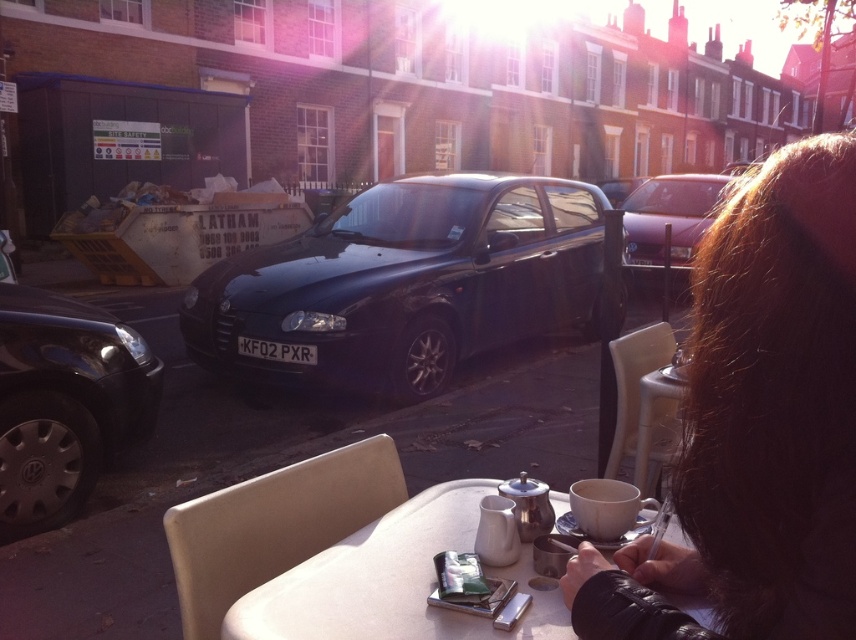
Who is higher up, dark brown hair at upper right or metallic purple car at center?

metallic purple car at center is above.

Where is `dark brown hair at upper right`? This screenshot has width=856, height=640. dark brown hair at upper right is located at coordinates (758, 424).

Locate an element on the screen. This screenshot has width=856, height=640. dark brown hair at upper right is located at coordinates (758, 424).

Which is below, dark brown hair at upper right or metallic silver table at lower center?

metallic silver table at lower center is lower down.

Image resolution: width=856 pixels, height=640 pixels. Describe the element at coordinates (758, 424) in the screenshot. I see `dark brown hair at upper right` at that location.

Is point (676, 636) in front of point (330, 627)?

Yes, it is.

What are the coordinates of `dark brown hair at upper right` in the screenshot? It's located at (758, 424).

Between point (847, 408) and point (9, 508), which one is positioned in front?

Point (847, 408)

Is dark brown hair at upper right further to the viewer compared to shiny black car at left?

That is False.

I want to click on dark brown hair at upper right, so click(x=758, y=424).